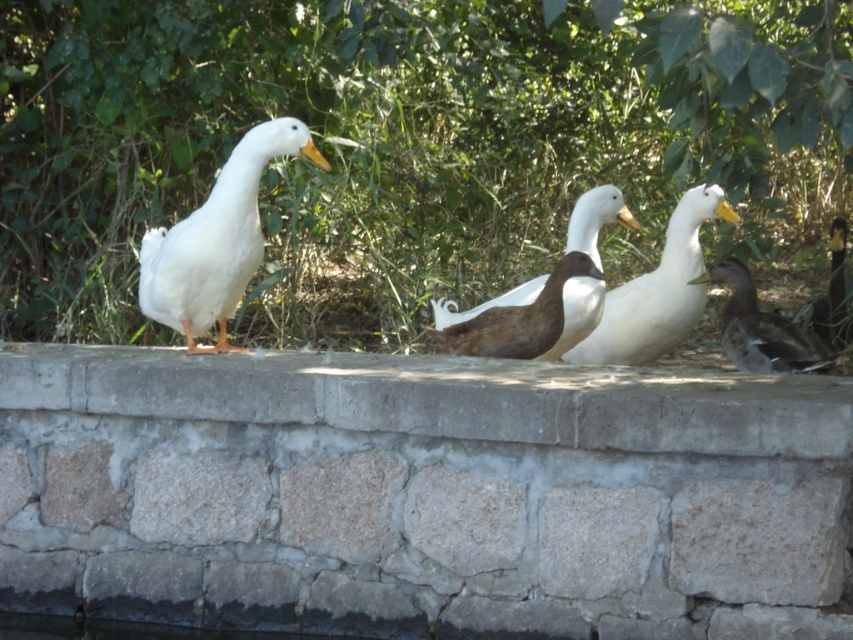
Between gray stone ledge at center and white matte duck at left, which one appears on the right side from the viewer's perspective?

gray stone ledge at center is more to the right.

Between gray stone ledge at center and white matte duck at left, which one has less height?

white matte duck at left is shorter.

Is point (369, 611) less distant than point (144, 269)?

Yes, point (369, 611) is in front of point (144, 269).

This screenshot has height=640, width=853. In order to click on gray stone ledge at center in this screenshot , I will do tap(421, 493).

Between white matte duck at center and brown matte duck at lower right, which one appears on the left side from the viewer's perspective?

white matte duck at center is more to the left.

Does white matte duck at center have a lesser width compared to brown matte duck at lower right?

No, white matte duck at center is not thinner than brown matte duck at lower right.

The width and height of the screenshot is (853, 640). Describe the element at coordinates (657, 291) in the screenshot. I see `white matte duck at center` at that location.

Where is `white matte duck at center`? This screenshot has width=853, height=640. white matte duck at center is located at coordinates (657, 291).

Does gray stone ledge at center come in front of brown matte goose at center?

Yes, it is in front of brown matte goose at center.

Between point (271, 353) and point (453, 316), which one is positioned in front?

Point (271, 353) is in front.

Find the location of a particular element. The image size is (853, 640). gray stone ledge at center is located at coordinates tap(421, 493).